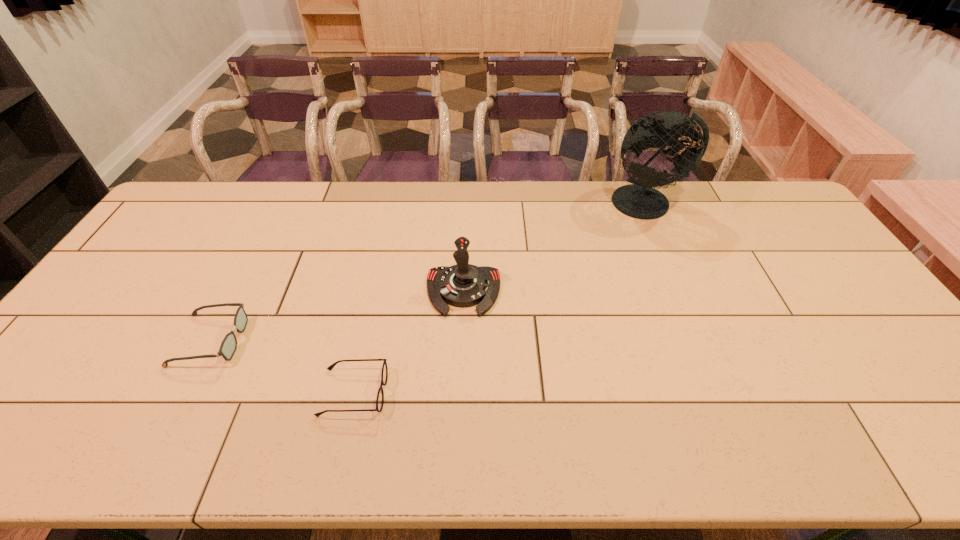
Identify the location of unoccupied area between the right spectacles and the joystick. (408, 342).

Find the location of a particular element. The width and height of the screenshot is (960, 540). blank region between the right spectacles and the tallest object is located at coordinates (500, 298).

Where is `unoccupied position between the joystick and the shorter spectacles`? unoccupied position between the joystick and the shorter spectacles is located at coordinates (408, 342).

In order to click on free space between the joystick and the left spectacles in this screenshot , I will do `click(337, 316)`.

Find the location of `free point between the leftmost object and the farthest object`. free point between the leftmost object and the farthest object is located at coordinates (429, 271).

You are a GUI agent. You are given a task and a screenshot of the screen. Output one action in this format:
    pyautogui.click(x=<x>, y=<y>)
    Task: Click on the free space between the farthest object and the shortest object
    The image size is (960, 540).
    Given the screenshot: What is the action you would take?
    pyautogui.click(x=500, y=298)

Locate an element on the screen. free spot between the joystick and the shortest object is located at coordinates (408, 342).

Locate which object is the closest to the globe. Please provide its 2D coordinates. Your answer should be formatted as a tuple, i.e. [(x, y)], where the tuple contains the x and y coordinates of a point satisfying the conditions above.

[(462, 285)]

This screenshot has height=540, width=960. I want to click on object that ranks as the third closest to the leftmost object, so click(639, 200).

The height and width of the screenshot is (540, 960). Find the location of `blank area in the image that satisfies the following two spatial constraints: 1. on the handle side of the second object from right to left; 2. on the face of the left spectacles`. blank area in the image that satisfies the following two spatial constraints: 1. on the handle side of the second object from right to left; 2. on the face of the left spectacles is located at coordinates (462, 340).